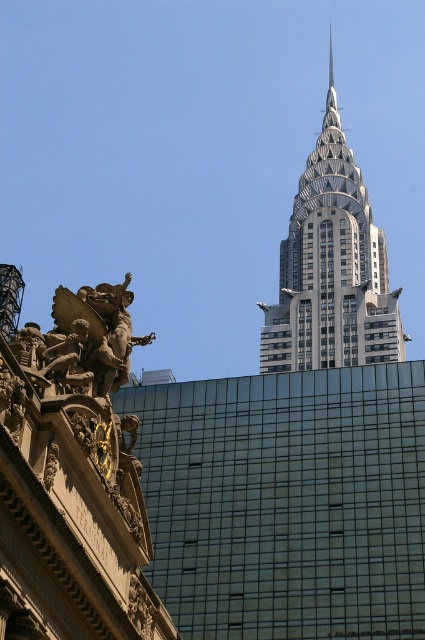
You are an architect observing the scene. You need to determine which object is taller between the silver metallic chrysler building at upper center and the bronze statue at left. Based on the scene, which one is taller?

The silver metallic chrysler building at upper center is much taller than the bronze statue at left.

You are an architect analyzing the spatial relationship between the silver metallic chrysler building at upper center and the bronze statue at left. Which object is closer to the viewer?

The silver metallic chrysler building at upper center is closer to the viewer than the bronze statue at left.

You are standing in the foreground of the image and want to take a photo of both the silver metallic chrysler building at upper center and the bronze statue at left. Which object should you adjust your camera to focus on first to ensure both are in the frame?

You should focus on the bronze statue at left first because the silver metallic chrysler building at upper center is to the right of bronze statue at left, so adjusting the camera to include the bronze statue at left first will allow you to frame the silver metallic chrysler building at upper center to its right.